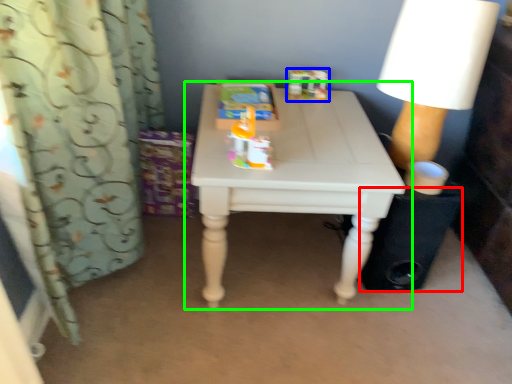
Question: Which object is the closest to the speaker (highlighted by a red box)? Choose among these: toy (highlighted by a blue box) or table (highlighted by a green box).

Choices:
 (A) toy
 (B) table

Answer: (B)